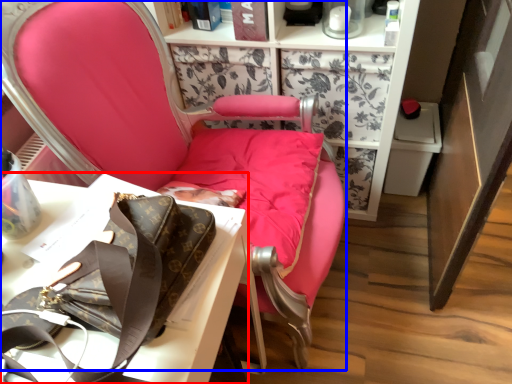
Question: Which object appears farthest to the camera in this image, desk (highlighted by a red box) or chair (highlighted by a blue box)?

Choices:
 (A) desk
 (B) chair

Answer: (A)